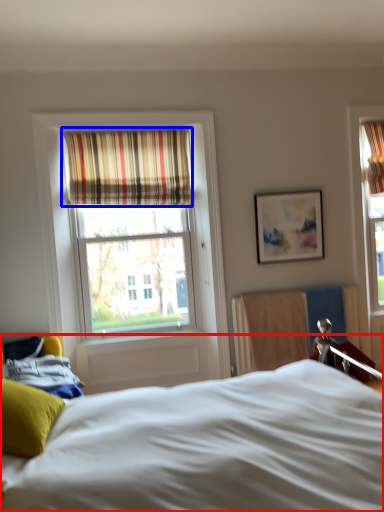
Question: Which object is closer to the camera taking this photo, bed (highlighted by a red box) or curtain (highlighted by a blue box)?

Choices:
 (A) bed
 (B) curtain

Answer: (A)